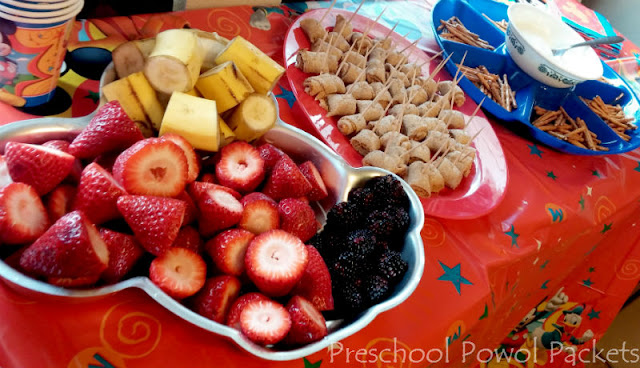
You are a GUI agent. You are given a task and a screenshot of the screen. Output one action in this format:
    pyautogui.click(x=<x>, y=<y>)
    Task: Click on the white bowl
    The height and width of the screenshot is (368, 640).
    Given the screenshot: What is the action you would take?
    pyautogui.click(x=536, y=65)